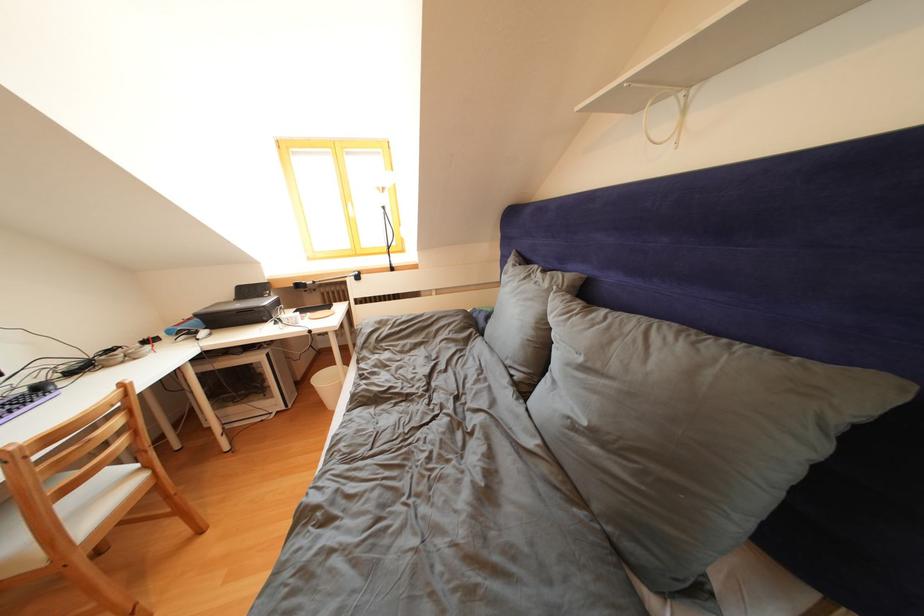
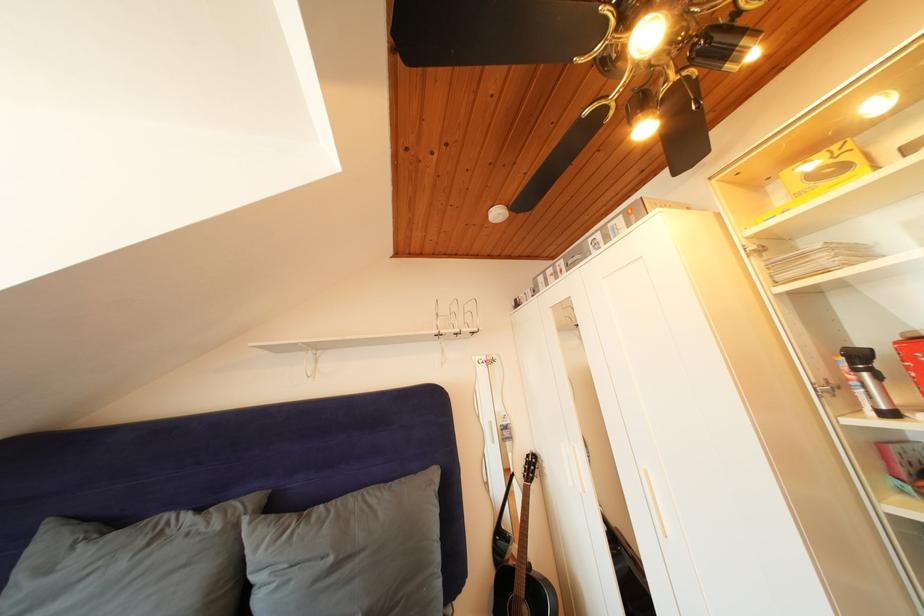
Where in the second image is the point corresponding to point (553, 290) from the first image?

(225, 531)